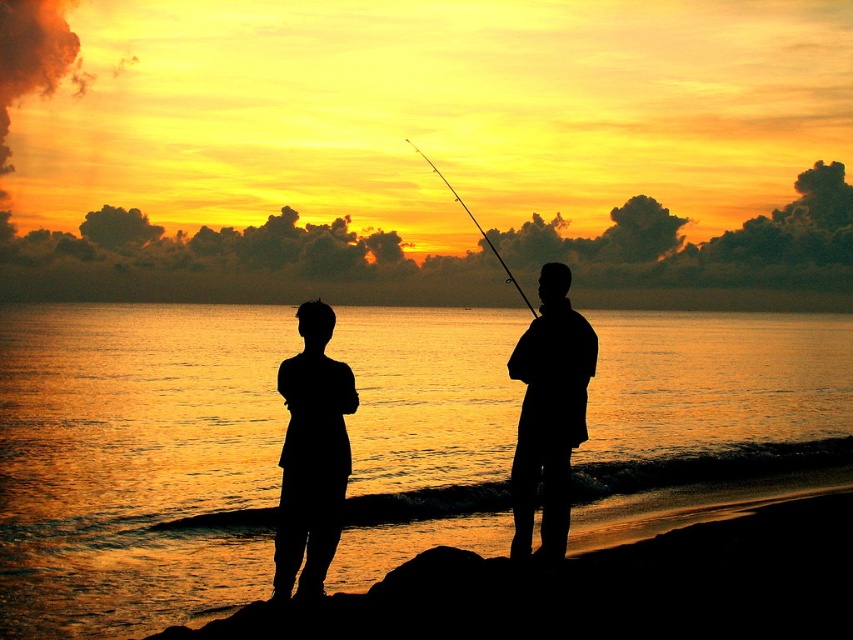
Question: Which object is the farthest from the smooth rod at center?

Choices:
 (A) silhouette clothing at center
 (B) silhouette fishing rod at center

Answer: (A)

Question: Which object appears farthest from the camera in this image?

Choices:
 (A) silhouette fishing rod at center
 (B) black matte figure at center
 (C) golden reflective water at center
 (D) silhouette clothing at center

Answer: (A)

Question: Is golden reflective water at center bigger than smooth rod at center?

Choices:
 (A) yes
 (B) no

Answer: (A)

Question: Is black matte figure at center below smooth rod at center?

Choices:
 (A) yes
 (B) no

Answer: (A)

Question: Where is black matte figure at center located in relation to silhouette fishing rod at center in the image?

Choices:
 (A) below
 (B) above

Answer: (A)

Question: Which of the following is the closest to the observer?

Choices:
 (A) black matte figure at center
 (B) golden reflective water at center
 (C) smooth rod at center
 (D) silhouette clothing at center

Answer: (A)